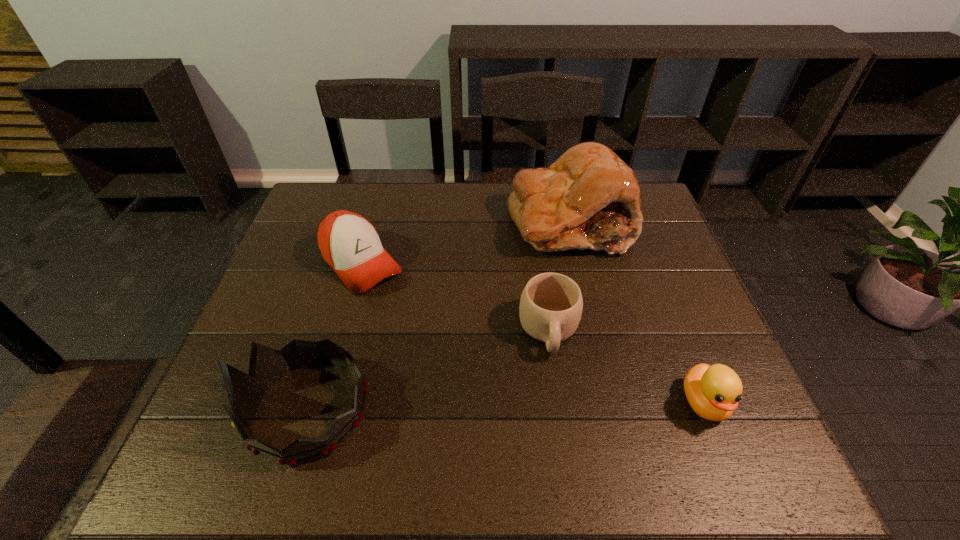
Identify the location of vacant space located on the filling side of the tallest object. This screenshot has width=960, height=540. (515, 308).

I want to click on vacant point located 0.080m on the filling side of the tallest object, so (536, 273).

Where is `free space located 0.090m on the filling side of the tallest object`? The height and width of the screenshot is (540, 960). free space located 0.090m on the filling side of the tallest object is located at coordinates (535, 275).

The width and height of the screenshot is (960, 540). Identify the location of vacant area located on the side of the mug with the handle. (557, 411).

Where is `free point located on the side of the mug with the handle`? The width and height of the screenshot is (960, 540). free point located on the side of the mug with the handle is located at coordinates (558, 420).

Where is `free space located 0.140m on the side of the mug with the handle`? free space located 0.140m on the side of the mug with the handle is located at coordinates (558, 420).

You are a GUI agent. You are given a task and a screenshot of the screen. Output one action in this format:
    pyautogui.click(x=<x>, y=<y>)
    Task: Click on the object that is at the far edge
    This screenshot has width=960, height=540.
    Given the screenshot: What is the action you would take?
    pyautogui.click(x=588, y=198)

The width and height of the screenshot is (960, 540). I want to click on tiara that is at the near edge, so click(267, 365).

Where is `duckling that is at the near edge`? duckling that is at the near edge is located at coordinates (713, 392).

The image size is (960, 540). What are the coordinates of `tiara that is at the left edge` in the screenshot? It's located at (267, 365).